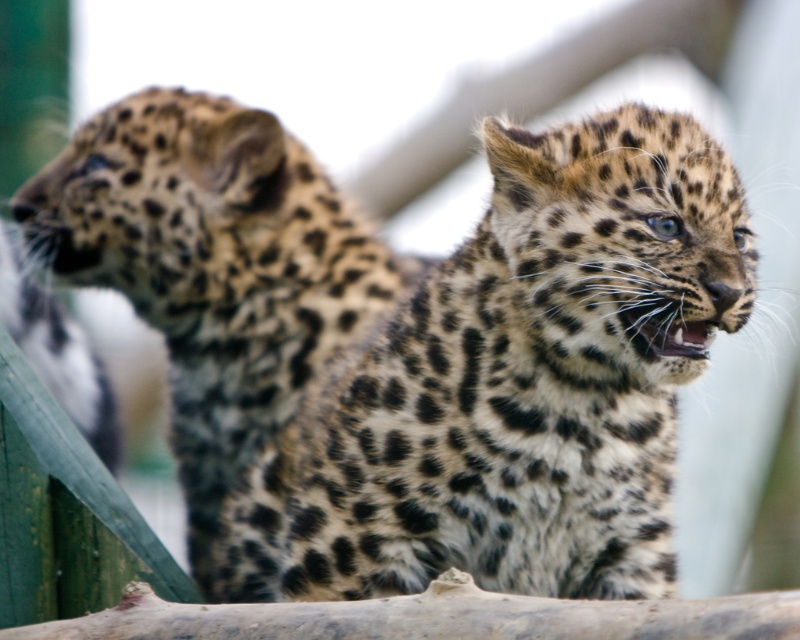
Between spotted fur cheetah at center and spotted fur cheetah at left, which one has more height?

Standing taller between the two is spotted fur cheetah at left.

Does spotted fur cheetah at center have a smaller size compared to spotted fur cheetah at left?

Incorrect, spotted fur cheetah at center is not smaller in size than spotted fur cheetah at left.

Is point (248, 552) more distant than point (272, 152)?

That is False.

Where is `spotted fur cheetah at center`? Image resolution: width=800 pixels, height=640 pixels. spotted fur cheetah at center is located at coordinates (516, 385).